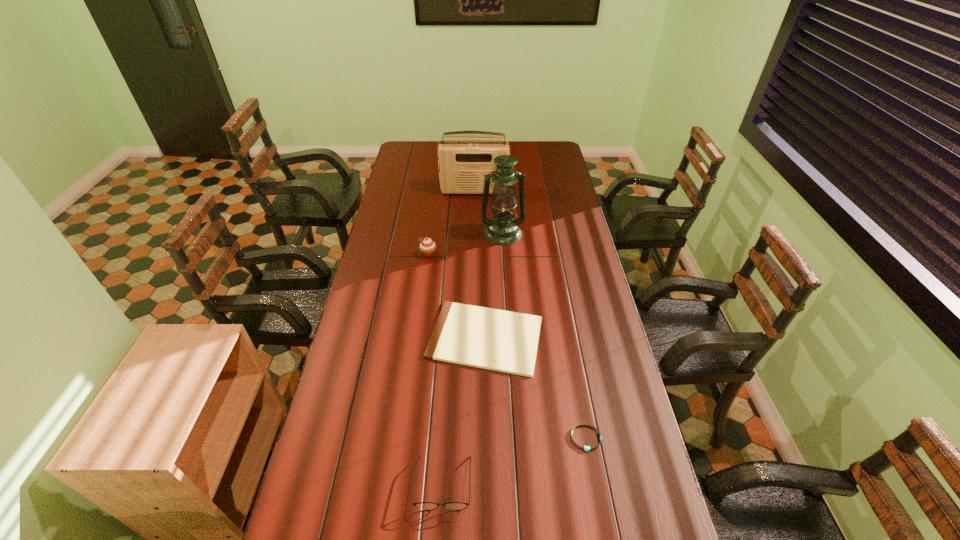
The height and width of the screenshot is (540, 960). Find the location of `the second farthest object`. the second farthest object is located at coordinates (502, 228).

At what (x,y) coordinates should I click in order to perform the action: click on the tallest object. Please return your answer as a coordinate pair (x, y). The image size is (960, 540). Looking at the image, I should click on (502, 228).

The width and height of the screenshot is (960, 540). I want to click on radio receiver, so click(462, 163).

The width and height of the screenshot is (960, 540). Identify the location of the farthest object. (462, 163).

Locate an element on the screen. the third farthest object is located at coordinates (427, 246).

At what (x,y) coordinates should I click in order to perform the action: click on the third tallest object. Please return your answer as a coordinate pair (x, y). The height and width of the screenshot is (540, 960). Looking at the image, I should click on (427, 246).

At what (x,y) coordinates should I click in order to perform the action: click on the nearest object. Please return your answer as a coordinate pair (x, y). Looking at the image, I should click on (427, 506).

Where is `spectacles`? The height and width of the screenshot is (540, 960). spectacles is located at coordinates 427,506.

Locate an element on the screen. This screenshot has width=960, height=540. the rightmost object is located at coordinates (587, 448).

Image resolution: width=960 pixels, height=540 pixels. What are the coordinates of `the fifth farthest object` in the screenshot? It's located at (587, 448).